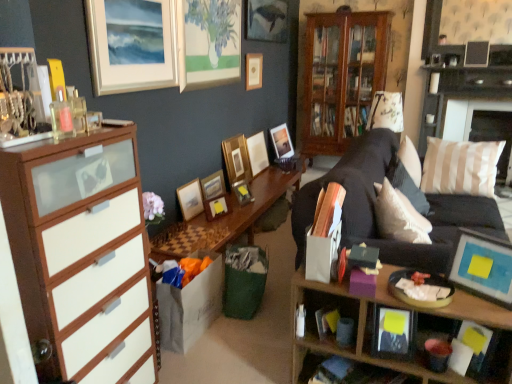
At what (x,y) coordinates should I click in order to perform the action: click on blank space situated above matte black book at lower center, which ranks as the 1th book in bottom-to-top order (from a real-world perspective). Please return your answer as a coordinate pair (x, y). Image resolution: width=512 pixels, height=384 pixels. Looking at the image, I should click on (352, 376).